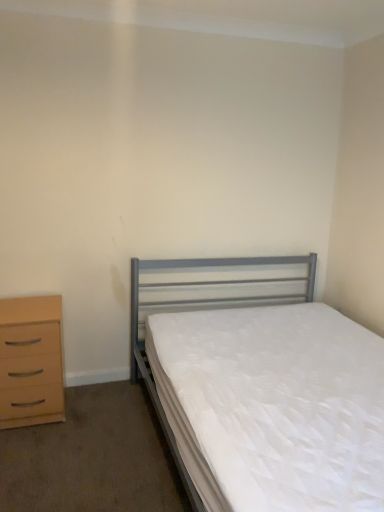
Identify the location of free space above light wood/texture chest of drawers at left (from a real-world perspective). (26, 308).